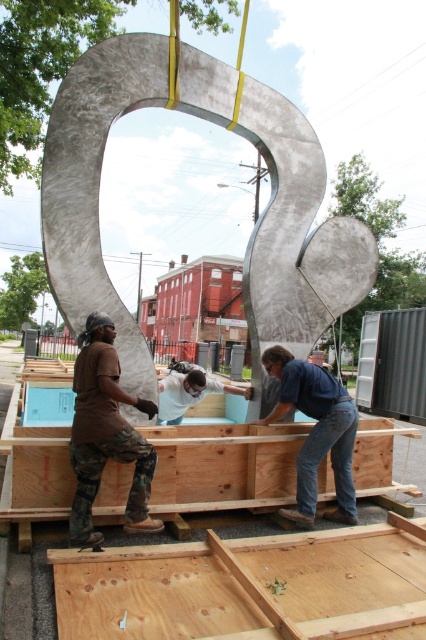
Question: Can you confirm if brown camouflage pants at lower left is bigger than white matte shirt at center?

Choices:
 (A) no
 (B) yes

Answer: (A)

Question: Which point is farther from the camera taking this photo?

Choices:
 (A) (391, 616)
 (B) (215, 392)

Answer: (B)

Question: Does brushed metal sculpture at center appear over white matte shirt at center?

Choices:
 (A) no
 (B) yes

Answer: (B)

Question: Which point is closer to the camera?

Choices:
 (A) (0, 477)
 (B) (89, 136)
 (C) (203, 369)
 (D) (270, 576)

Answer: (D)

Question: Can you confirm if wooden crates at center is positioned below white matte shirt at center?

Choices:
 (A) no
 (B) yes

Answer: (B)

Question: Based on their relative distances, which object is farther from the light brown wooden crate at lower center?

Choices:
 (A) wooden crates at center
 (B) brushed metal sculpture at center
 (C) white matte shirt at center

Answer: (B)